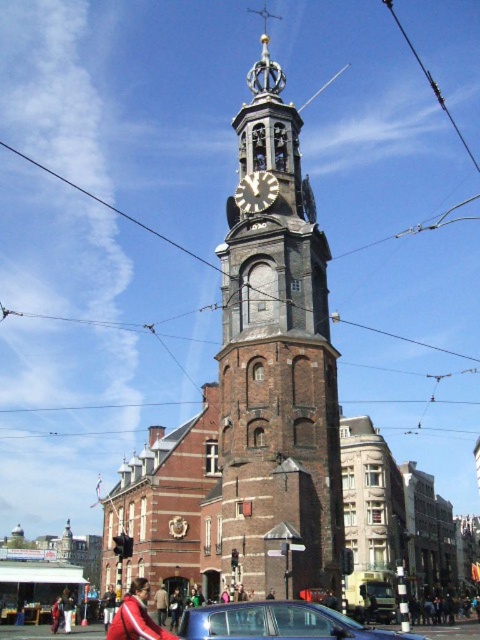
You are an architect planning to install a new weather vane on the tallest object in the scene. Which object should you choose between the brick tower at center and the silver metallic clock at upper center?

The brick tower at center is taller than the silver metallic clock at upper center, so you should install the weather vane on the brick tower at center.

You are a tourist visiting the clock tower and want to take a photo that includes both the brick tower at center and the silver metallic clock at upper center. Which object should you focus on first to ensure both are in frame?

The brick tower at center is bigger than the silver metallic clock at upper center, so you should focus on the brick tower at center first to ensure both are in frame.